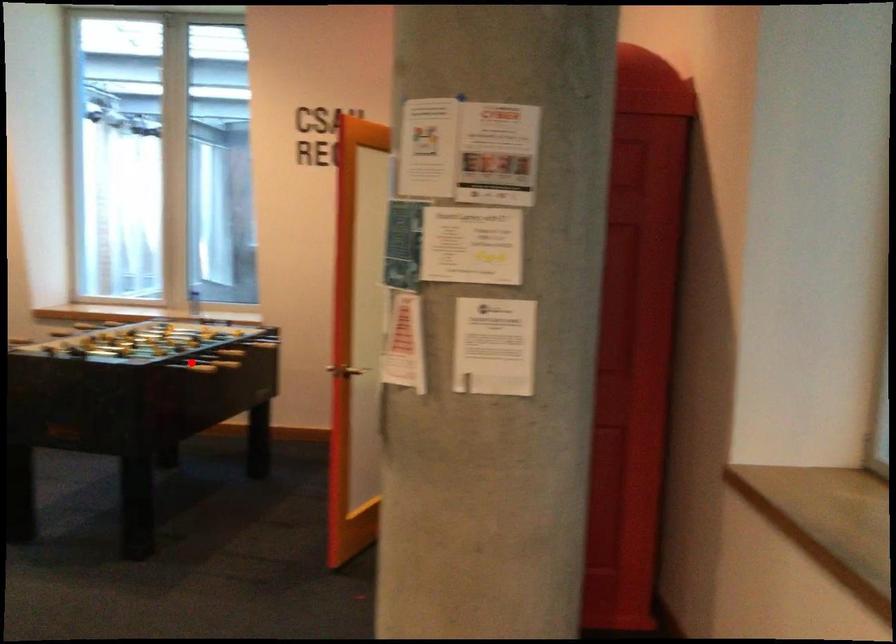
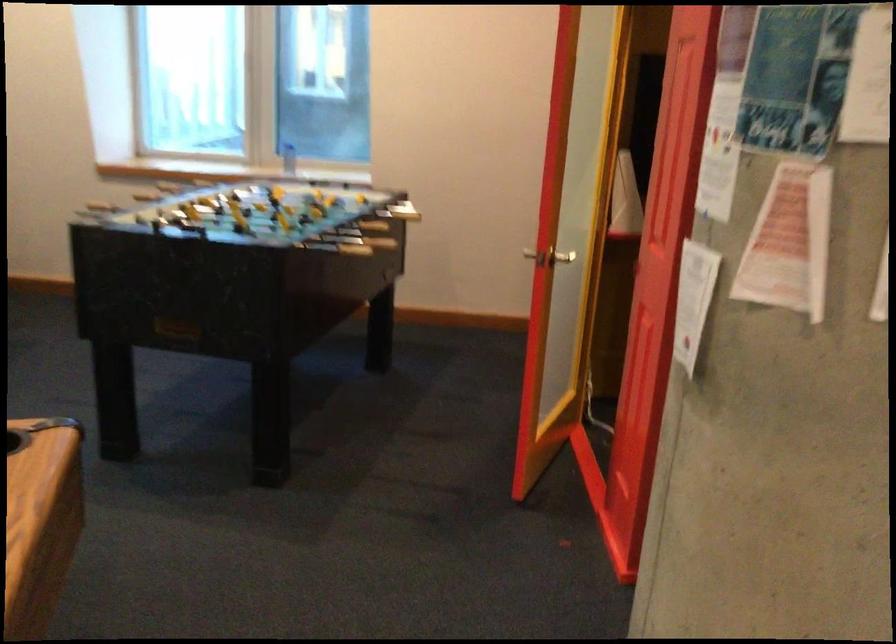
Where in the second image is the point corresponding to the highlighted location from the first image?

(339, 248)